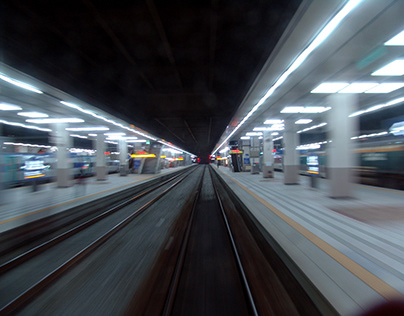
This screenshot has width=404, height=316. What are the coordinates of `yellow light in front of staircase` in the screenshot? It's located at (140, 156).